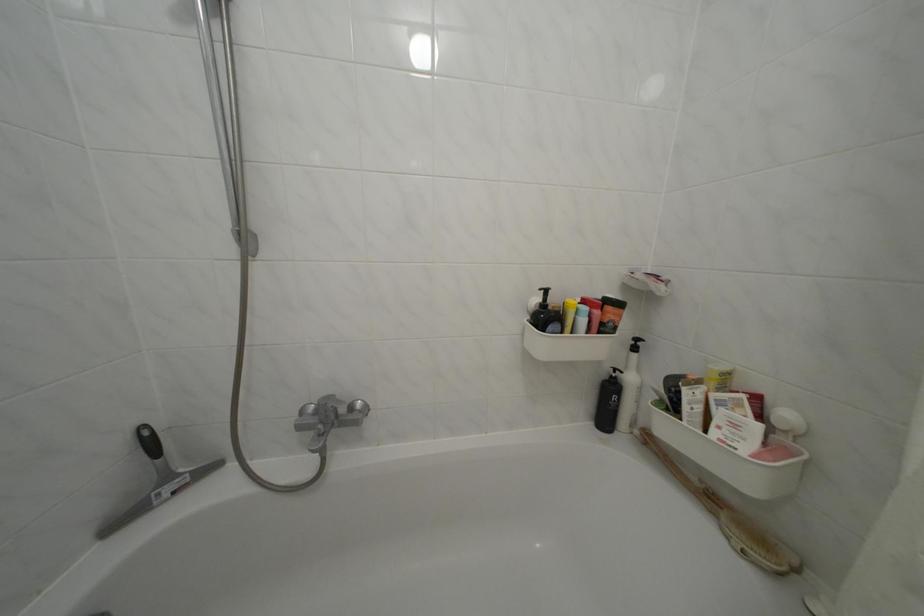
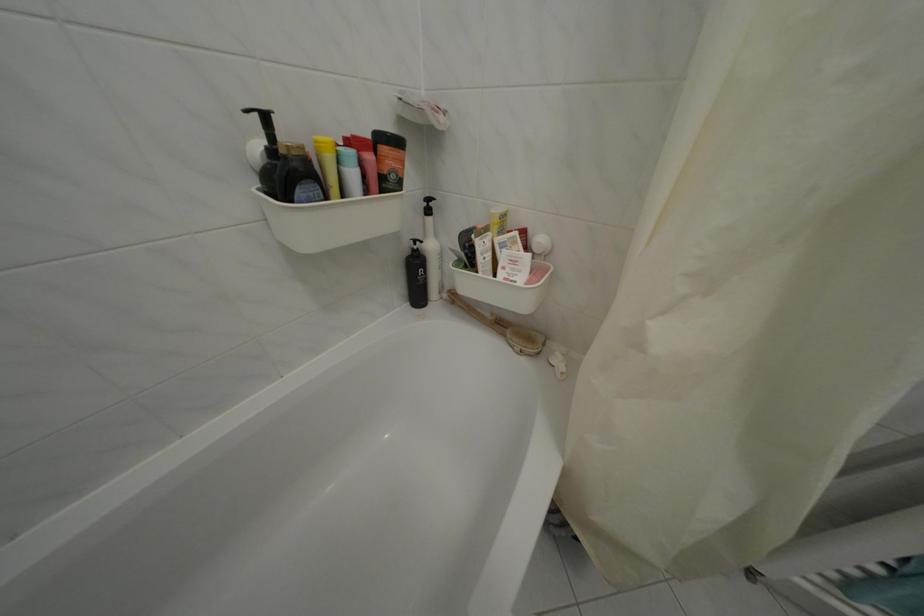
Find the pixel in the second image that matches [619,394] in the first image.

(424, 269)